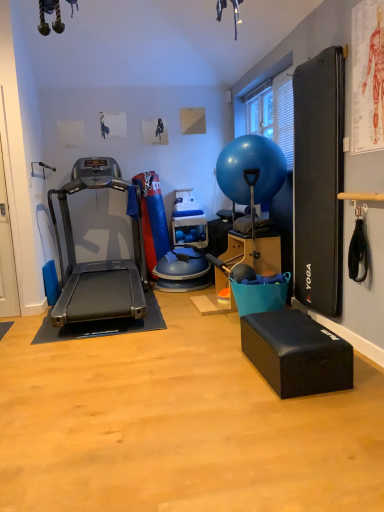
Locate an element on the screen. black foam footrest at lower right is located at coordinates (296, 353).

The height and width of the screenshot is (512, 384). What do you see at coordinates (251, 169) in the screenshot?
I see `blue rubber ball at center` at bounding box center [251, 169].

This screenshot has height=512, width=384. In order to click on black foam footrest at lower right in this screenshot , I will do `click(296, 353)`.

From a real-world perspective, is blue rubber ball at center physically above black foam footrest at lower right?

Yes, from a real-world perspective, blue rubber ball at center is on top of black foam footrest at lower right.

From their relative heights in the image, would you say blue rubber ball at center is taller or shorter than black foam footrest at lower right?

Clearly, blue rubber ball at center is taller compared to black foam footrest at lower right.

Is blue rubber ball at center bigger than black foam footrest at lower right?

Correct, blue rubber ball at center is larger in size than black foam footrest at lower right.

Is blue rubber ball at center to the right of black foam footrest at lower right from the viewer's perspective?

No, blue rubber ball at center is not to the right of black foam footrest at lower right.

Which of these two, black foam footrest at lower right or black rubber treadmill at left, stands shorter?

Standing shorter between the two is black foam footrest at lower right.

Which is correct: black foam footrest at lower right is inside black rubber treadmill at left, or outside of it?

black foam footrest at lower right lies outside black rubber treadmill at left.

Consider the image. Does black foam footrest at lower right come in front of black rubber treadmill at left?

Yes, black foam footrest at lower right is closer to the viewer.

Can you confirm if blue rubber ball at center is positioned to the right of black rubber treadmill at left?

Indeed, blue rubber ball at center is positioned on the right side of black rubber treadmill at left.

Can you confirm if blue rubber ball at center is smaller than black rubber treadmill at left?

Correct, blue rubber ball at center occupies less space than black rubber treadmill at left.

Is blue rubber ball at center spatially inside black rubber treadmill at left, or outside of it?

blue rubber ball at center is spatially situated outside black rubber treadmill at left.

From a real-world perspective, is blue rubber ball at center located higher than black rubber treadmill at left?

Yes, from a real-world perspective, blue rubber ball at center is over black rubber treadmill at left

From the picture: Does black rubber treadmill at left have a greater height compared to black foam footrest at lower right?

Yes.

Is black rubber treadmill at left to the left or to the right of black foam footrest at lower right in the image?

black rubber treadmill at left is to the left of black foam footrest at lower right.

In the scene shown: From a real-world perspective, who is located higher, black rubber treadmill at left or black foam footrest at lower right?

In real-world perspective, black rubber treadmill at left is above.

Considering the sizes of objects black rubber treadmill at left and black foam footrest at lower right in the image provided, who is bigger, black rubber treadmill at left or black foam footrest at lower right?

black rubber treadmill at left.

Based on the photo, which of these two, black rubber treadmill at left or blue rubber ball at center, is bigger?

Bigger between the two is black rubber treadmill at left.

Based on the photo, is black rubber treadmill at left facing away from blue rubber ball at center?

No, black rubber treadmill at left is not facing the opposite direction of blue rubber ball at center.

Considering the relative positions of black rubber treadmill at left and blue rubber ball at center in the image provided, is black rubber treadmill at left to the left of blue rubber ball at center from the viewer's perspective?

A: Yes, black rubber treadmill at left is to the left of blue rubber ball at center.

Is the surface of black foam footrest at lower right in direct contact with blue rubber ball at center?

No, black foam footrest at lower right is not making contact with blue rubber ball at center.

Who is smaller, black foam footrest at lower right or blue rubber ball at center?

With smaller size is black foam footrest at lower right.

Which is more to the left, black foam footrest at lower right or blue rubber ball at center?

Positioned to the left is blue rubber ball at center.

From the image's perspective, is black foam footrest at lower right located above or below blue rubber ball at center?

Based on their image positions, black foam footrest at lower right is located beneath blue rubber ball at center.

The width and height of the screenshot is (384, 512). In order to click on ball that appears behind the black foam footrest at lower right in this screenshot , I will do `click(251, 169)`.

Where is `treadmill above the black foam footrest at lower right (from a real-world perspective)`? treadmill above the black foam footrest at lower right (from a real-world perspective) is located at coordinates (98, 261).

Looking at the image, which one is located further to black foam footrest at lower right, black rubber treadmill at left or blue rubber ball at center?

Based on the image, black rubber treadmill at left appears to be further to black foam footrest at lower right.

Which object lies further to the anchor point blue rubber ball at center, black foam footrest at lower right or black rubber treadmill at left?

black foam footrest at lower right is positioned further to the anchor blue rubber ball at center.

Estimate the real-world distances between objects in this image. Which object is further from black foam footrest at lower right, blue rubber ball at center or black rubber treadmill at left?

Among the two, black rubber treadmill at left is located further to black foam footrest at lower right.

From the image, which object appears to be nearer to black rubber treadmill at left, black foam footrest at lower right or blue rubber ball at center?

blue rubber ball at center is positioned closer to the anchor black rubber treadmill at left.

From the image, which object appears to be farther from blue rubber ball at center, black rubber treadmill at left or black foam footrest at lower right?

The object further to blue rubber ball at center is black foam footrest at lower right.

Looking at this image, looking at the image, which one is located further to black rubber treadmill at left, blue rubber ball at center or black foam footrest at lower right?

black foam footrest at lower right is further to black rubber treadmill at left.

In order to click on ball between black rubber treadmill at left and black foam footrest at lower right in the horizontal direction in this screenshot , I will do `click(251, 169)`.